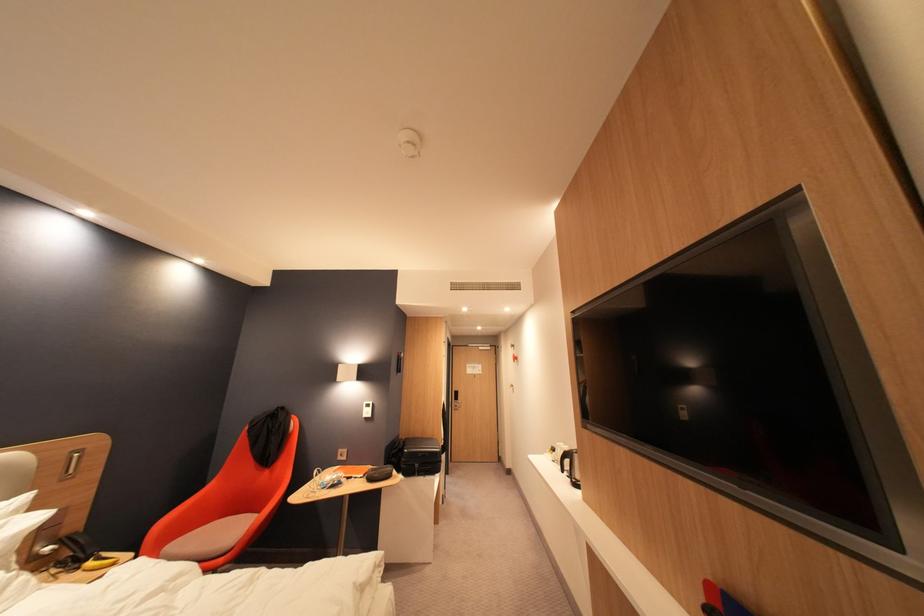
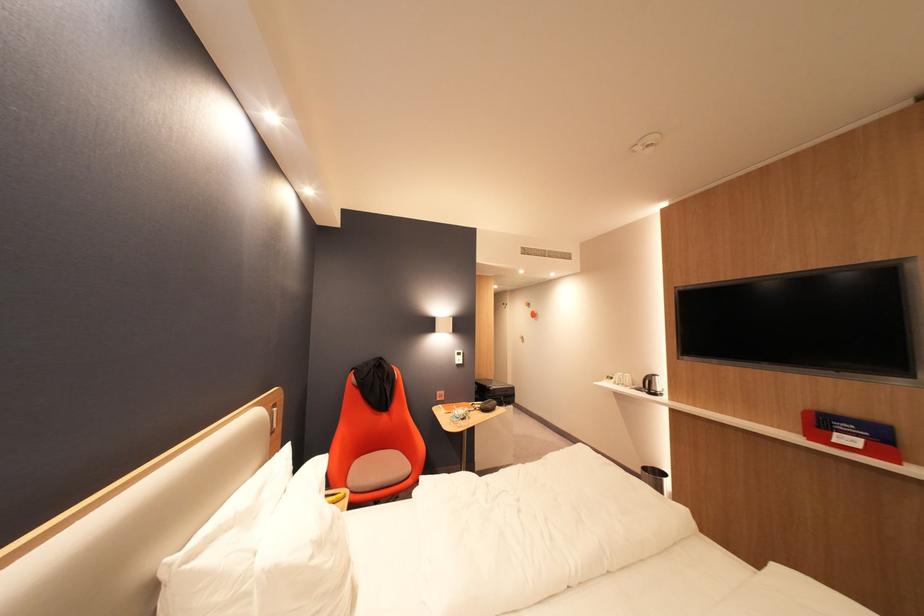
In the second image, find the point that corresponds to (584,482) in the first image.

(662, 392)